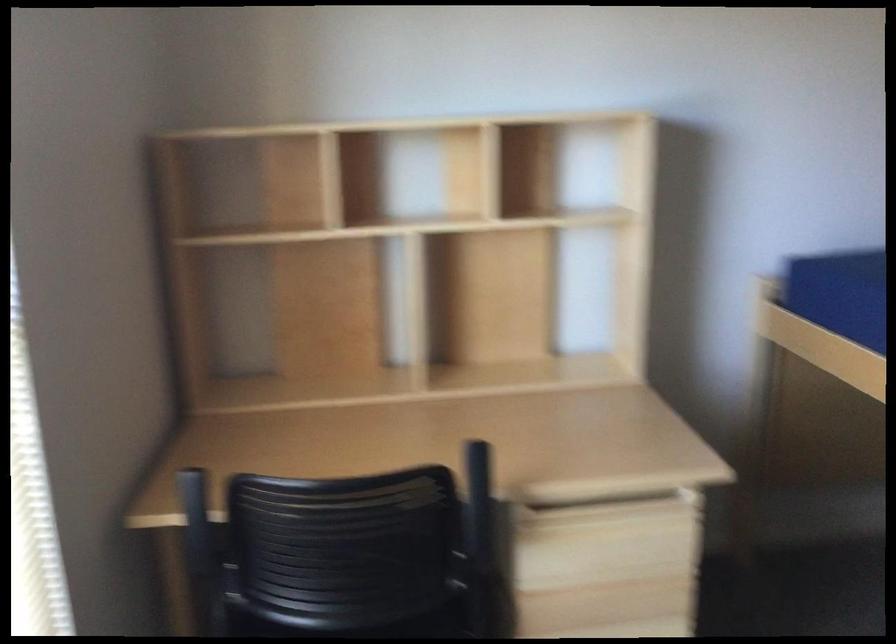
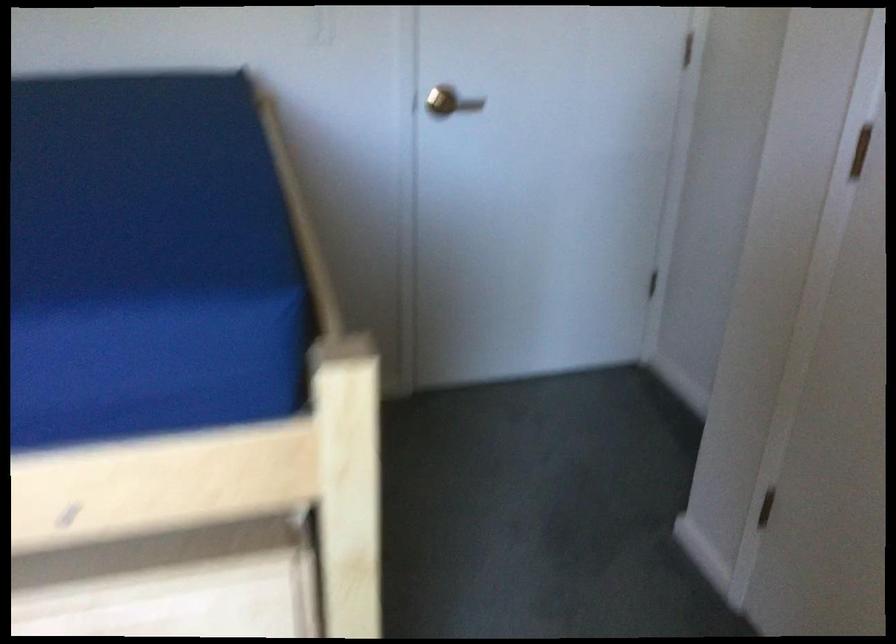
Based on the continuous images, in which direction is the camera rotating?

The camera's rotation is toward right-down.